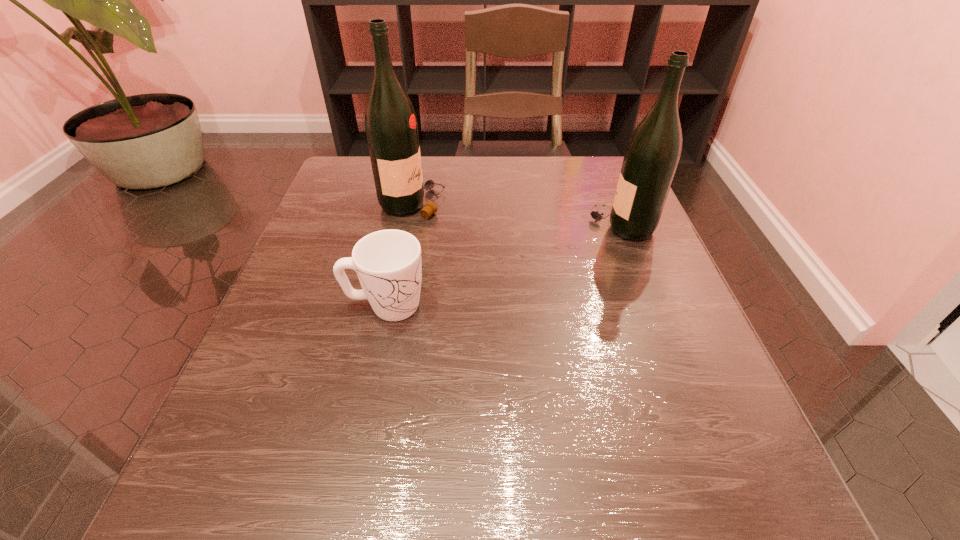
This screenshot has width=960, height=540. I want to click on empty space that is in between the left wine bottle and the right wine bottle, so click(x=516, y=214).

You are a GUI agent. You are given a task and a screenshot of the screen. Output one action in this format:
    pyautogui.click(x=<x>, y=<y>)
    Task: Click on the vacant space that's between the mug and the right wine bottle
    
    Given the screenshot: What is the action you would take?
    pyautogui.click(x=503, y=266)

Locate an element on the screen. vacant area between the rightmost object and the left wine bottle is located at coordinates (516, 214).

What are the coordinates of `free space between the shortest object and the right wine bottle` in the screenshot? It's located at [503, 266].

You are a GUI agent. You are given a task and a screenshot of the screen. Output one action in this format:
    pyautogui.click(x=<x>, y=<y>)
    Task: Click on the free space between the left wine bottle and the right wine bottle
    
    Given the screenshot: What is the action you would take?
    pyautogui.click(x=516, y=214)

You are a GUI agent. You are given a task and a screenshot of the screen. Output one action in this format:
    pyautogui.click(x=<x>, y=<y>)
    Task: Click on the vacant area that lies between the rightmost object and the mug
    The height and width of the screenshot is (540, 960).
    Given the screenshot: What is the action you would take?
    pyautogui.click(x=503, y=266)

Locate an element on the screen. This screenshot has height=540, width=960. unoccupied area between the right wine bottle and the left wine bottle is located at coordinates (516, 214).

Identify the location of vacant space that's between the right wine bottle and the left wine bottle. (516, 214).

At what (x,y) coordinates should I click in order to perform the action: click on object that is the nearest to the rightmost object. Please return your answer as a coordinate pair (x, y). The image size is (960, 540). Looking at the image, I should click on (391, 127).

Identify the location of object that can be found as the closest to the left wine bottle. (388, 263).